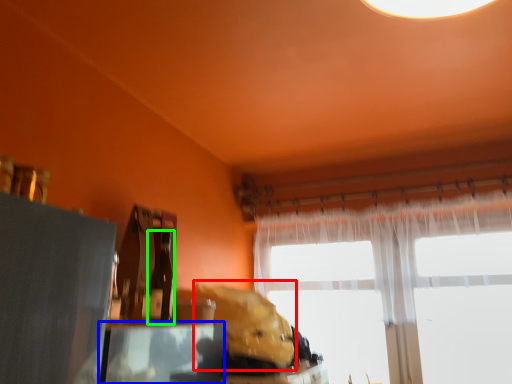
Question: Which object is the closest to the animal (highlighted by a red box)? Choose among these: table (highlighted by a blue box) or bottle (highlighted by a green box).

Choices:
 (A) table
 (B) bottle

Answer: (A)